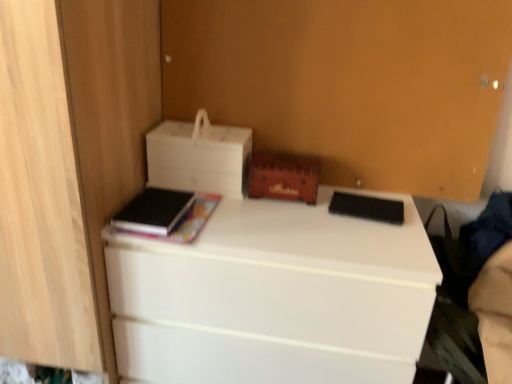
Locate an element on the screen. free spot in front of black matte paperback book at center, the 2th paperback book when ordered from left to right is located at coordinates (373, 236).